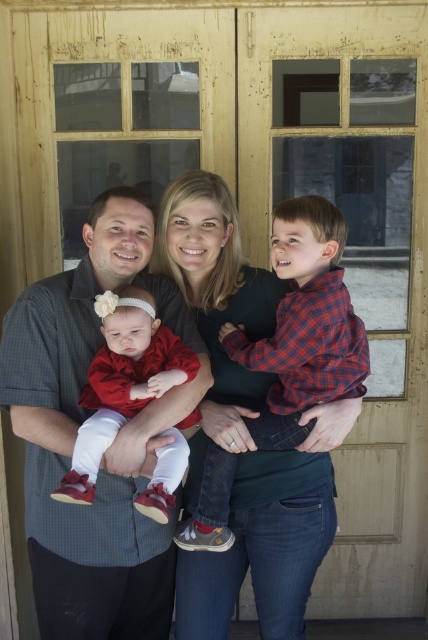
Does point (80, 513) lie behind point (56, 492)?

Yes, point (80, 513) is behind point (56, 492).

Is brushed metal shirt at center smaller than matte red dress at center?

Actually, brushed metal shirt at center might be larger than matte red dress at center.

What do you see at coordinates (76, 435) in the screenshot? This screenshot has height=640, width=428. I see `brushed metal shirt at center` at bounding box center [76, 435].

Locate an element on the screen. brushed metal shirt at center is located at coordinates (76, 435).

Is brushed metal shirt at center below plaid cotton shirt at center?

Yes.

Does point (130, 621) come closer to viewer compared to point (231, 340)?

No, (130, 621) is further to viewer.

This screenshot has height=640, width=428. What are the coordinates of `brushed metal shirt at center` in the screenshot? It's located at (76, 435).

Does plaid cotton shirt at center have a lesser width compared to matte red dress at center?

No.

Is point (333, 324) positioned before point (118, 369)?

Yes, it is.

The height and width of the screenshot is (640, 428). I want to click on plaid cotton shirt at center, so click(x=303, y=324).